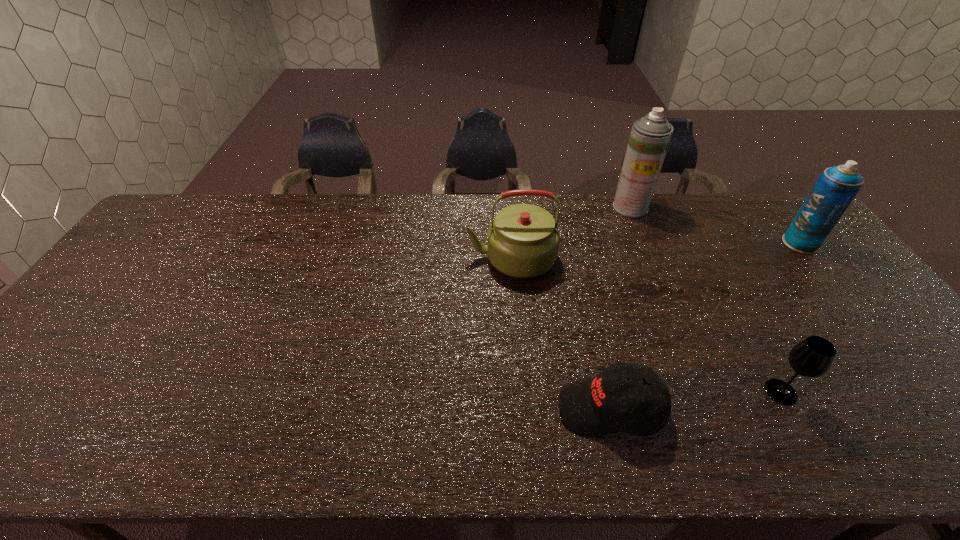
The image size is (960, 540). In order to click on object situated at the far right corner in this screenshot , I will do `click(835, 189)`.

This screenshot has width=960, height=540. In the image, there is a desktop. What are the coordinates of `vacant space at the far edge` in the screenshot? It's located at (353, 201).

Where is `free spot at the near edge of the desktop`? free spot at the near edge of the desktop is located at coordinates (845, 455).

Locate an element on the screen. The width and height of the screenshot is (960, 540). blank area at the left edge is located at coordinates (17, 409).

Locate an element on the screen. Image resolution: width=960 pixels, height=540 pixels. free space at the right edge of the desktop is located at coordinates (874, 309).

This screenshot has height=540, width=960. Find the location of `vacant area at the far left corner`. vacant area at the far left corner is located at coordinates (183, 208).

Where is `vacant space at the far right corner`? This screenshot has height=540, width=960. vacant space at the far right corner is located at coordinates (783, 211).

The width and height of the screenshot is (960, 540). Identify the location of empty space between the kettle and the shorter aerosol can. (656, 251).

This screenshot has width=960, height=540. Identify the location of free space between the kettle and the tallest object. (570, 233).

Find the location of a particular element. free space between the rightmost object and the baseball cap is located at coordinates (706, 326).